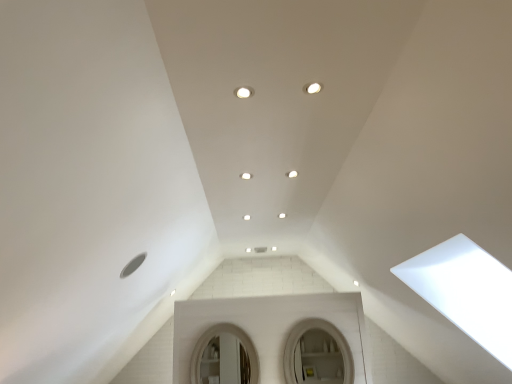
Question: From a real-world perspective, does white glossy mirror at center, the second mirror in the left-to-right sequence, stand above white matte mirror at center, which is counted as the first mirror, starting from the left?

Choices:
 (A) no
 (B) yes

Answer: (A)

Question: Is white glossy mirror at center, positioned as the 1th mirror in right-to-left order, positioned behind white matte mirror at center, arranged as the 2th mirror when viewed from the right?

Choices:
 (A) no
 (B) yes

Answer: (A)

Question: Is white glossy mirror at center, positioned as the 1th mirror in right-to-left order, wider than white matte mirror at center, which is counted as the first mirror, starting from the left?

Choices:
 (A) yes
 (B) no

Answer: (A)

Question: Is white matte mirror at center, arranged as the 2th mirror when viewed from the right, inside white glossy mirror at center, positioned as the 1th mirror in right-to-left order?

Choices:
 (A) yes
 (B) no

Answer: (B)

Question: Considering the relative sizes of white glossy mirror at center, the second mirror in the left-to-right sequence, and white matte mirror at center, arranged as the 2th mirror when viewed from the right, in the image provided, is white glossy mirror at center, the second mirror in the left-to-right sequence, shorter than white matte mirror at center, arranged as the 2th mirror when viewed from the right,?

Choices:
 (A) no
 (B) yes

Answer: (A)

Question: Looking at their shapes, would you say white glossy mirror at center, the second mirror in the left-to-right sequence, is wider or thinner than white matte mirror at center, arranged as the 2th mirror when viewed from the right?

Choices:
 (A) thin
 (B) wide

Answer: (B)

Question: Do you think white glossy mirror at center, positioned as the 1th mirror in right-to-left order, is within white matte mirror at center, which is counted as the first mirror, starting from the left, or outside of it?

Choices:
 (A) inside
 (B) outside

Answer: (B)

Question: Considering their positions, is white glossy mirror at center, the second mirror in the left-to-right sequence, located in front of or behind white matte mirror at center, which is counted as the first mirror, starting from the left?

Choices:
 (A) behind
 (B) front

Answer: (B)

Question: Considering the positions of point (288, 355) and point (249, 340), is point (288, 355) closer or farther from the camera than point (249, 340)?

Choices:
 (A) closer
 (B) farther

Answer: (A)

Question: Considering the positions of white glossy light fixture at center and white glossy mirror at center, positioned as the 1th mirror in right-to-left order, in the image, is white glossy light fixture at center wider or thinner than white glossy mirror at center, positioned as the 1th mirror in right-to-left order,?

Choices:
 (A) wide
 (B) thin

Answer: (A)

Question: Does point (293, 172) appear closer or farther from the camera than point (291, 365)?

Choices:
 (A) farther
 (B) closer

Answer: (B)

Question: Considering the relative positions of white glossy light fixture at center and white glossy mirror at center, the second mirror in the left-to-right sequence, in the image provided, is white glossy light fixture at center to the left or to the right of white glossy mirror at center, the second mirror in the left-to-right sequence,?

Choices:
 (A) left
 (B) right

Answer: (A)

Question: Choose the correct answer: Is white glossy light fixture at center inside white glossy mirror at center, positioned as the 1th mirror in right-to-left order, or outside it?

Choices:
 (A) inside
 (B) outside

Answer: (B)

Question: Considering the positions of white glossy mirror at center, the second mirror in the left-to-right sequence, and white glossy light fixture at center in the image, is white glossy mirror at center, the second mirror in the left-to-right sequence, bigger or smaller than white glossy light fixture at center?

Choices:
 (A) big
 (B) small

Answer: (A)

Question: Looking at their shapes, would you say white glossy mirror at center, positioned as the 1th mirror in right-to-left order, is wider or thinner than white glossy light fixture at center?

Choices:
 (A) thin
 (B) wide

Answer: (A)